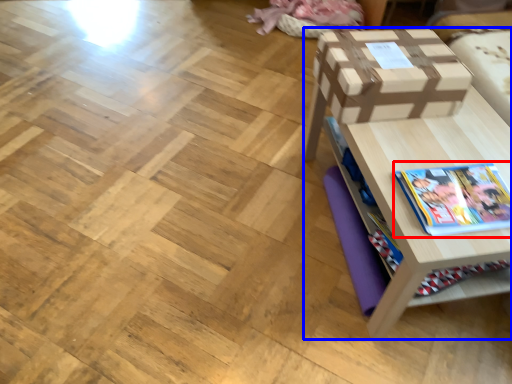
Question: Which object appears closest to the camera in this image, book (highlighted by a red box) or table (highlighted by a blue box)?

Choices:
 (A) book
 (B) table

Answer: (B)